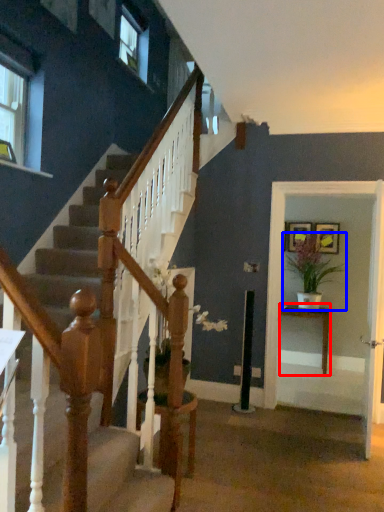
Question: Which point is further to the camera, table (highlighted by a red box) or houseplant (highlighted by a blue box)?

Choices:
 (A) table
 (B) houseplant

Answer: (A)